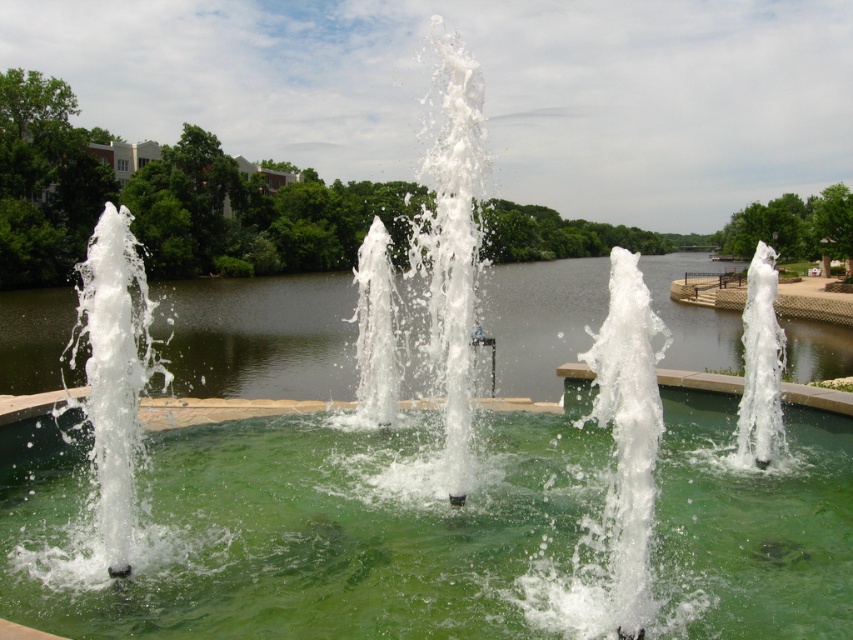
Can you confirm if green glossy water at center is positioned above green water at center?

No.

Who is more forward, (787, 621) or (4, 348)?

Positioned in front is point (787, 621).

Who is more forward, (293, 484) or (28, 321)?

Point (293, 484) is in front.

At what (x,y) coordinates should I click in order to perform the action: click on green glossy water at center. Please return your answer as a coordinate pair (x, y). Looking at the image, I should click on [317, 532].